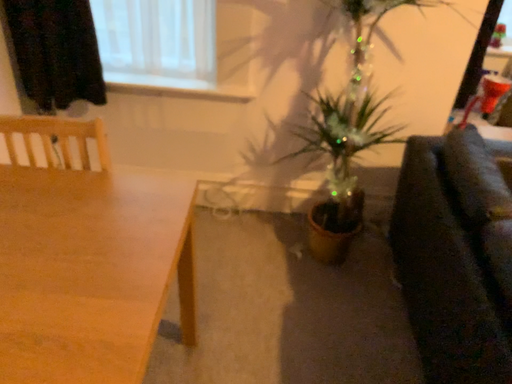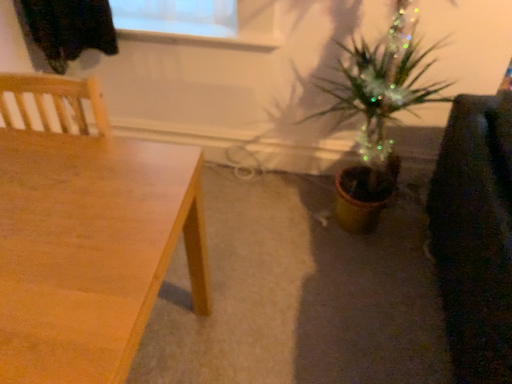
Question: Which way did the camera rotate in the video?

Choices:
 (A) rotated downward
 (B) rotated upward

Answer: (A)